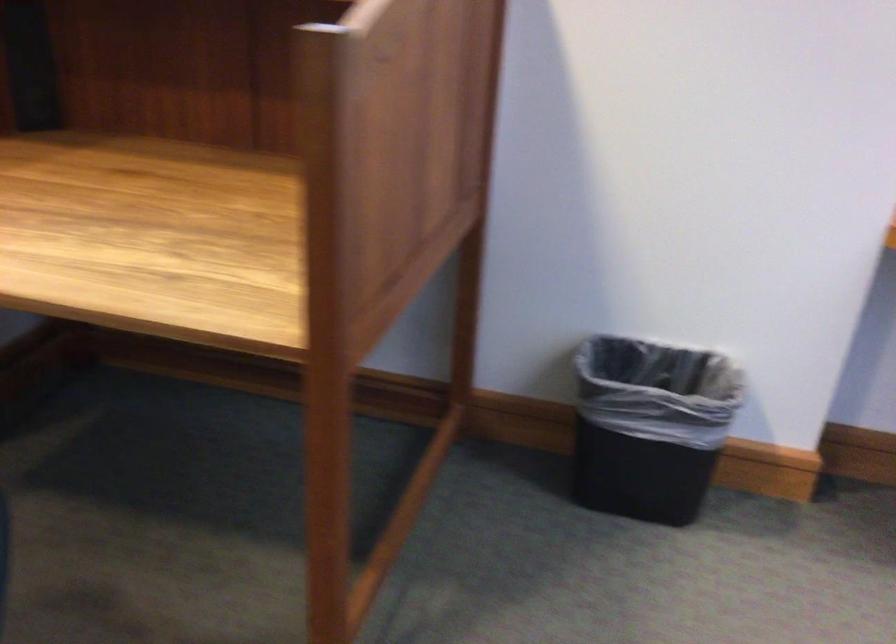
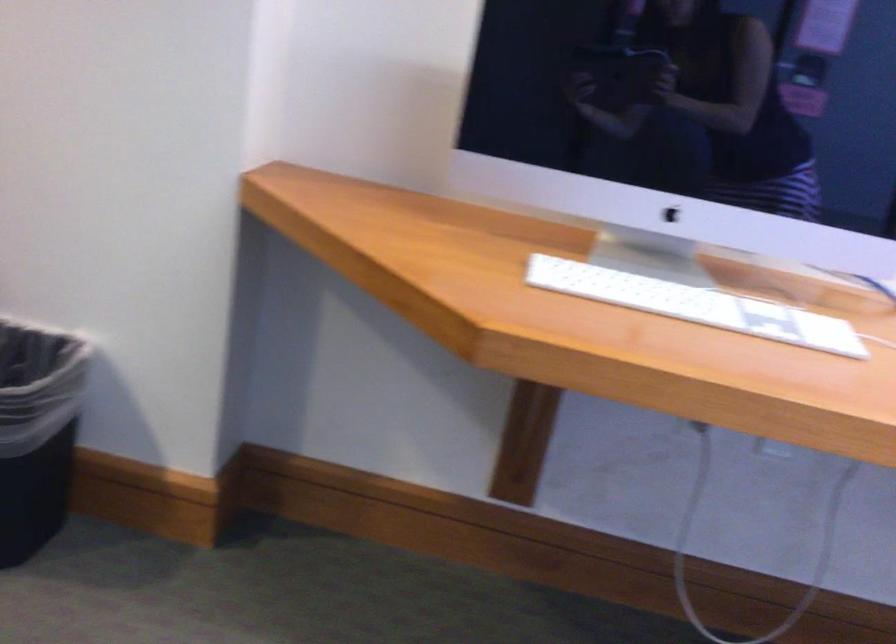
Question: In a continuous first-person perspective shot, in which direction is the camera moving?

Choices:
 (A) Left
 (B) Right
 (C) Forward
 (D) Backward

Answer: (B)